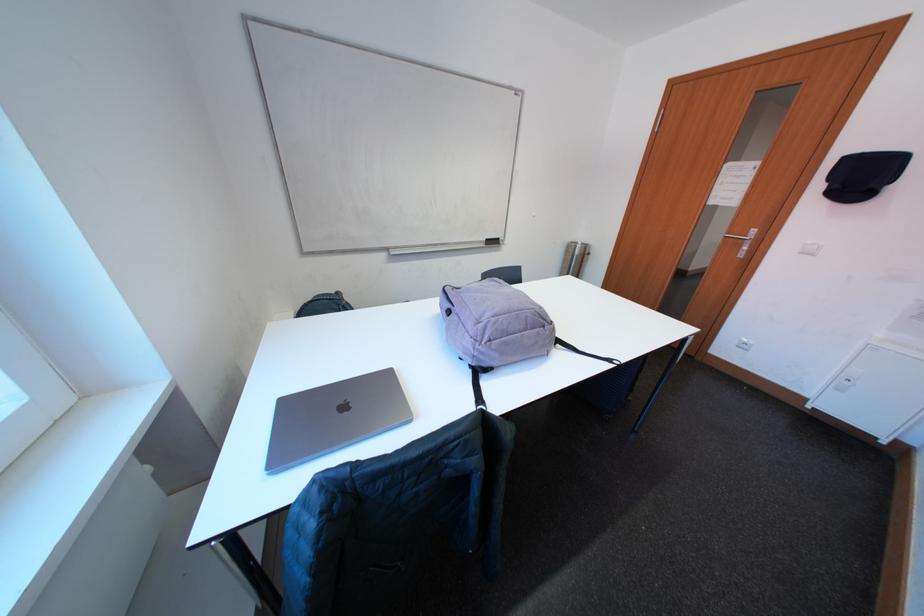
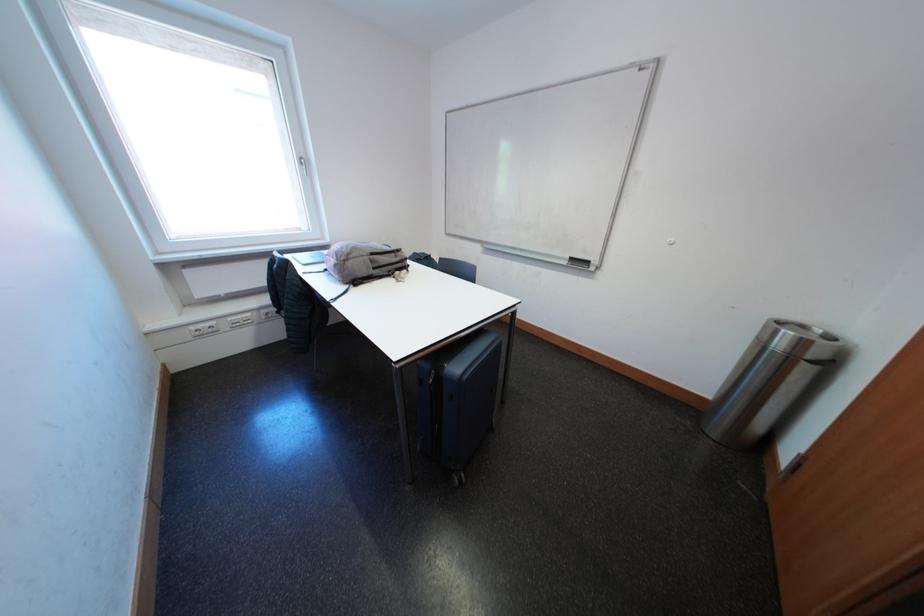
Locate, in the second image, the point that corresponds to point 493,248 in the first image.

(575, 267)